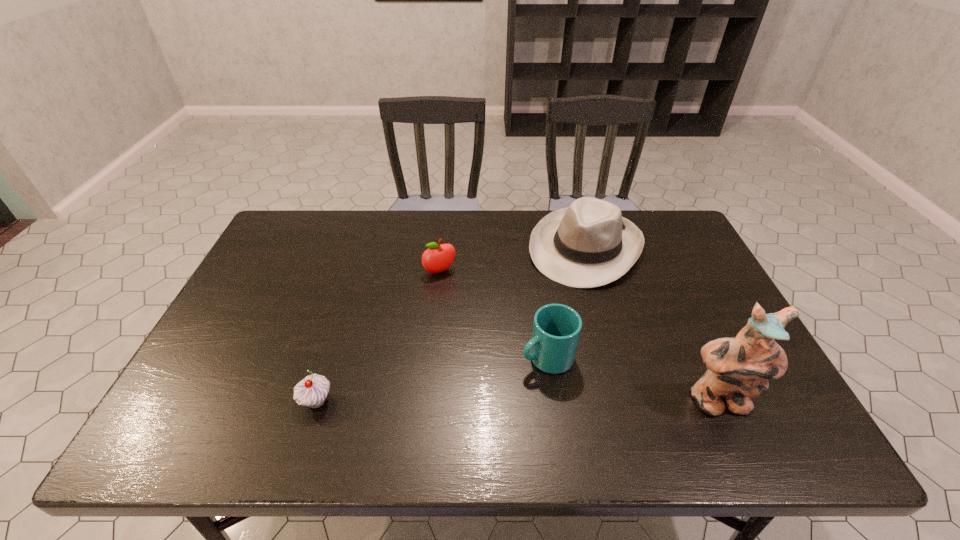
This screenshot has width=960, height=540. In order to click on the leftmost object in this screenshot , I will do `click(312, 391)`.

Where is `the tallest object`? This screenshot has height=540, width=960. the tallest object is located at coordinates (739, 368).

Image resolution: width=960 pixels, height=540 pixels. I want to click on fedora, so click(x=589, y=244).

You are a GUI agent. You are given a task and a screenshot of the screen. Output one action in this format:
    pyautogui.click(x=<x>, y=<y>)
    Task: Click on the cup
    This screenshot has width=960, height=540.
    Given the screenshot: What is the action you would take?
    pyautogui.click(x=556, y=329)

This screenshot has width=960, height=540. Find the location of `apple`. apple is located at coordinates (438, 258).

Find the location of a particular element. Image resolution: width=960 pixels, height=540 pixels. free space located on the back of the leftmost object is located at coordinates (355, 278).

Image resolution: width=960 pixels, height=540 pixels. Identify the location of free space located on the front-facing side of the fedora. (551, 308).

Where is `vacant space positioned on the front-facing side of the fedora`? This screenshot has height=540, width=960. vacant space positioned on the front-facing side of the fedora is located at coordinates (549, 310).

Where is `vacant space situated on the front-facing side of the fedora`? This screenshot has height=540, width=960. vacant space situated on the front-facing side of the fedora is located at coordinates (511, 373).

I want to click on vacant space located 0.180m on the handle side of the third farthest object, so click(x=459, y=399).